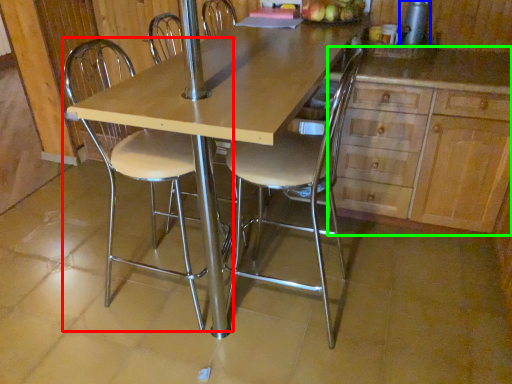
Question: Which object is the farthest from chair (highlighted by a red box)? Choose among these: appliance (highlighted by a blue box) or cabinetry (highlighted by a green box).

Choices:
 (A) appliance
 (B) cabinetry

Answer: (A)